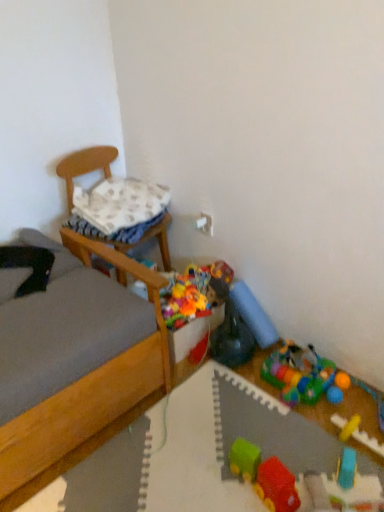
Where is `free space behind yellow rubber train at lower right, placed as the fifth toy when sorted from back to front`? The image size is (384, 512). free space behind yellow rubber train at lower right, placed as the fifth toy when sorted from back to front is located at coordinates (350, 415).